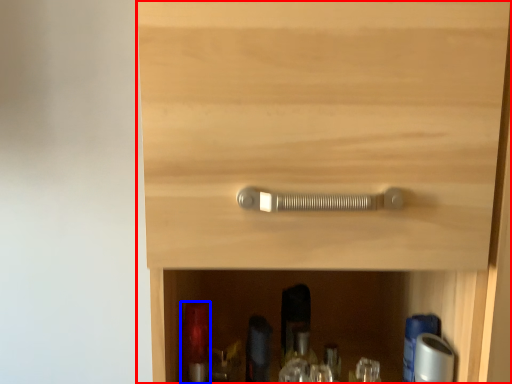
Question: Which point is further to the camera, cupboard (highlighted by a red box) or bottle (highlighted by a blue box)?

Choices:
 (A) cupboard
 (B) bottle

Answer: (B)